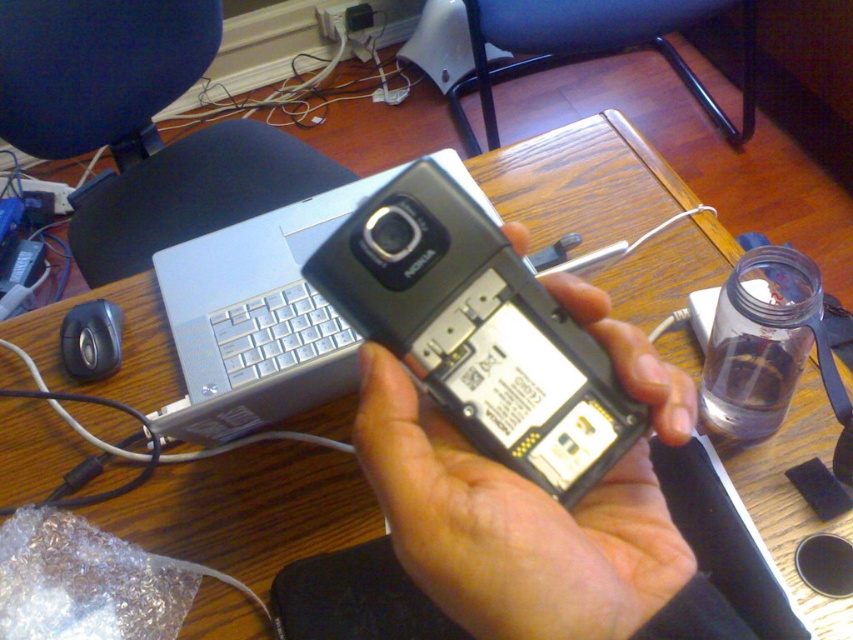
Is metallic silver phone at center shorter than clear glass bottle at right?

No.

Who is lower down, metallic silver phone at center or clear glass bottle at right?

metallic silver phone at center

Which is in front, point (664, 509) or point (743, 356)?

Point (664, 509) is more forward.

Where is `metallic silver phone at center`? Image resolution: width=853 pixels, height=640 pixels. metallic silver phone at center is located at coordinates (512, 525).